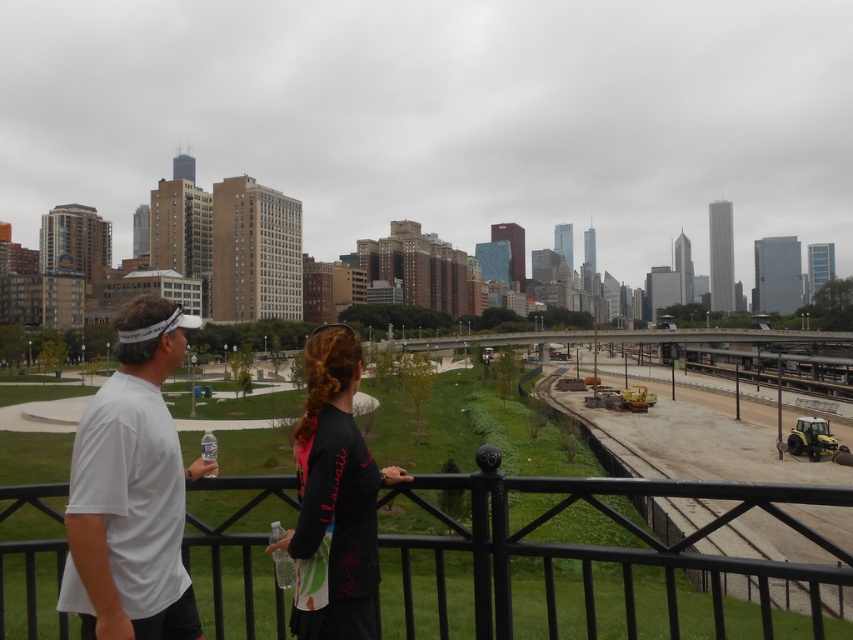
Question: Can you confirm if white matte shirt at center is wider than black matte shirt at center?

Choices:
 (A) yes
 (B) no

Answer: (B)

Question: Which of the following is the farthest from the observer?

Choices:
 (A) (166, 486)
 (B) (805, 602)
 (C) (379, 470)
 (D) (167, 577)

Answer: (B)

Question: Is white matte shirt at center bigger than white matte shirt at left?

Choices:
 (A) yes
 (B) no

Answer: (A)

Question: Which point appears farthest from the camera in this image?

Choices:
 (A) (86, 433)
 (B) (332, 404)
 (C) (80, 582)
 (D) (440, 570)

Answer: (D)

Question: Among these points, which one is nearest to the camera?

Choices:
 (A) (730, 566)
 (B) (108, 570)
 (C) (345, 419)
 (D) (167, 374)

Answer: (B)

Question: Is white matte shirt at left positioned at the back of black matte shirt at center?

Choices:
 (A) no
 (B) yes

Answer: (A)